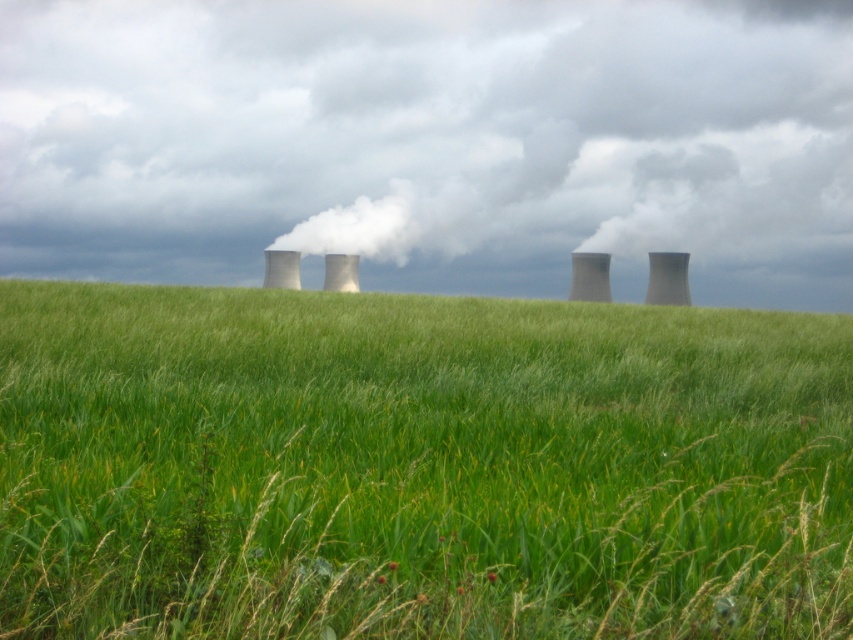
You are standing in the green grassy field at center and want to walk towards the white smoke at upper center. Which direction should you head?

The green grassy field at center is to the left of white smoke at upper center, so you should head to the right to reach the white smoke at upper center.

You are a landscape photographer planning to capture the green grassy field at center and the white smoke at upper center in a single shot. Based on their widths, which object would appear narrower in the photo?

The green grassy field at center has a lesser width compared to the white smoke at upper center, so it would appear narrower in the photo.

You are a photographer trying to capture the entire scene of the green grassy field at center and the white smoke at upper center in one shot. Based on their sizes in the image, which one would appear smaller in the photo?

The green grassy field at center appears smaller in the photo because it has a smaller size compared to the white smoke at upper center according to the description.